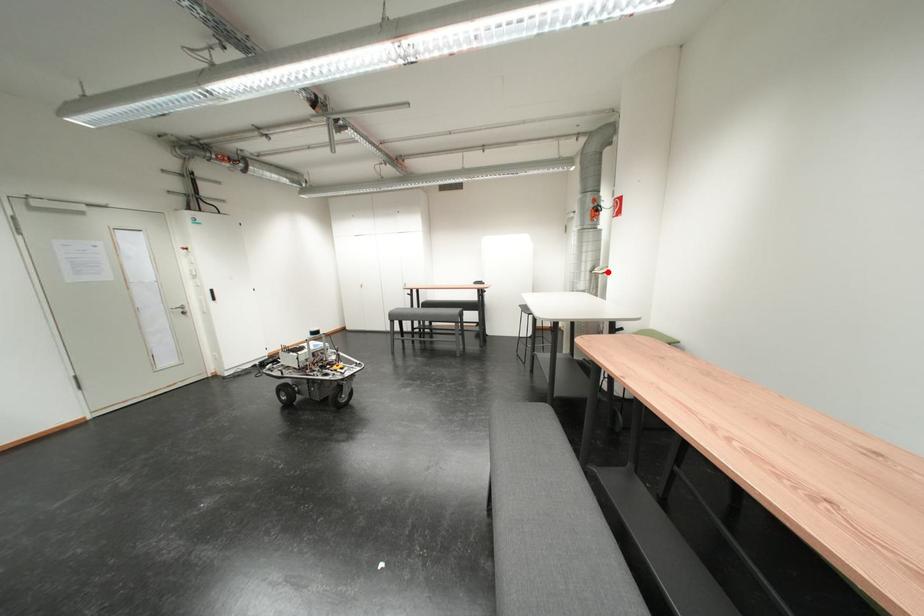
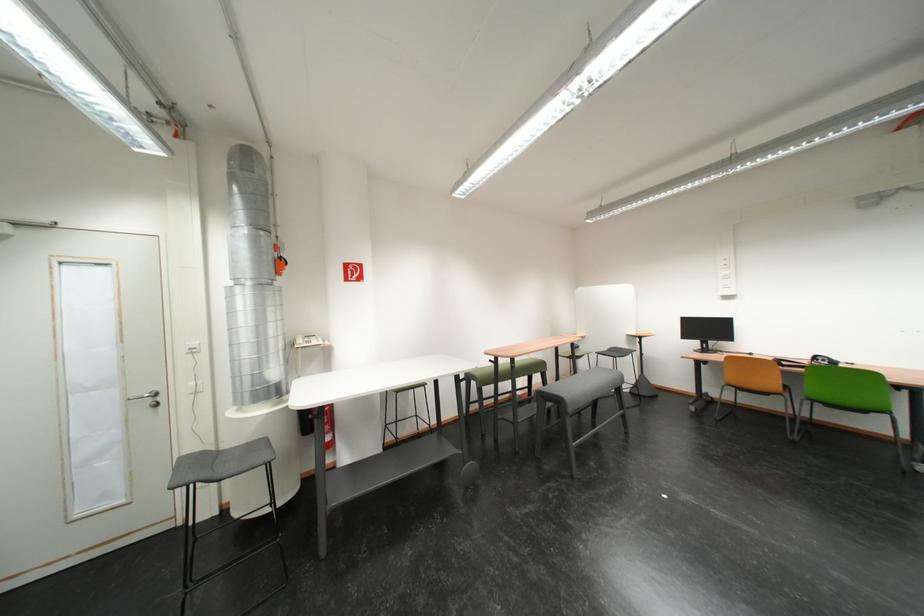
Question: I am providing you with two images of the same scene from different viewpoints. A red point is marked on the first image. Can you still see the location of the red point in image 2?

Choices:
 (A) Yes
 (B) No

Answer: (A)